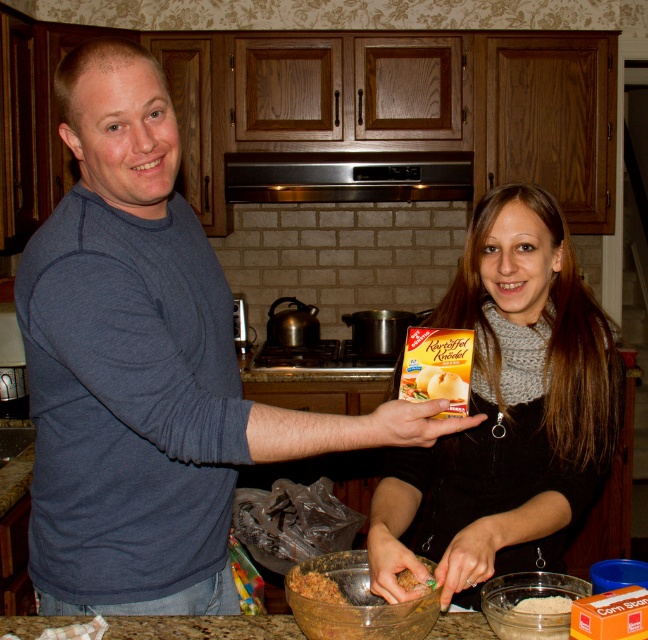
You are a chef preparing a dish and need to place both the black knit scarf at center and the white matte rice at lower right on a shelf. The shelf has a height limit of 10 cm. Can you fit both items on the shelf without exceeding the height limit?

The black knit scarf at center is taller than the white matte rice at lower right. Since the shelf has a height limit of 10 cm, you need to check the height of the taller item. If the black knit scarf at center is under 10 cm, both can fit. If it exceeds, only the white matte rice at lower right can be placed.

You are a chef trying to determine which item is wider between the black knit scarf at center and the shiny brown mixture at center. Based on the scene, can you confirm which one is wider?

The black knit scarf at center is wider than the shiny brown mixture at center according to the description.